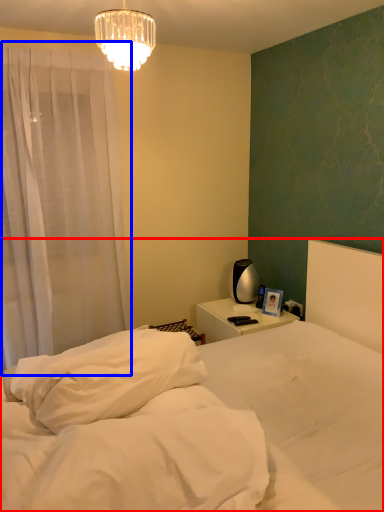
Question: Which point is closer to the camera, bed (highlighted by a red box) or curtain (highlighted by a blue box)?

Choices:
 (A) bed
 (B) curtain

Answer: (A)